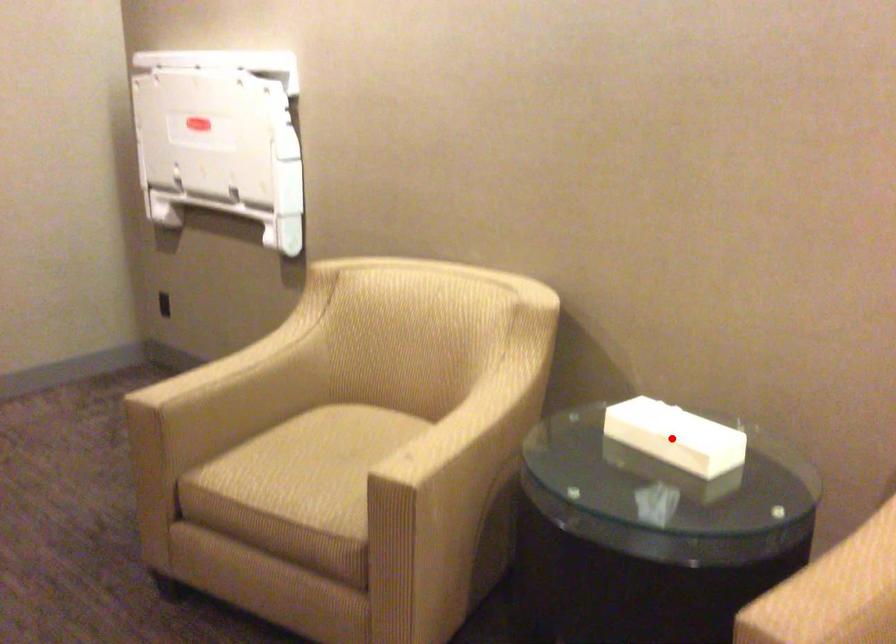
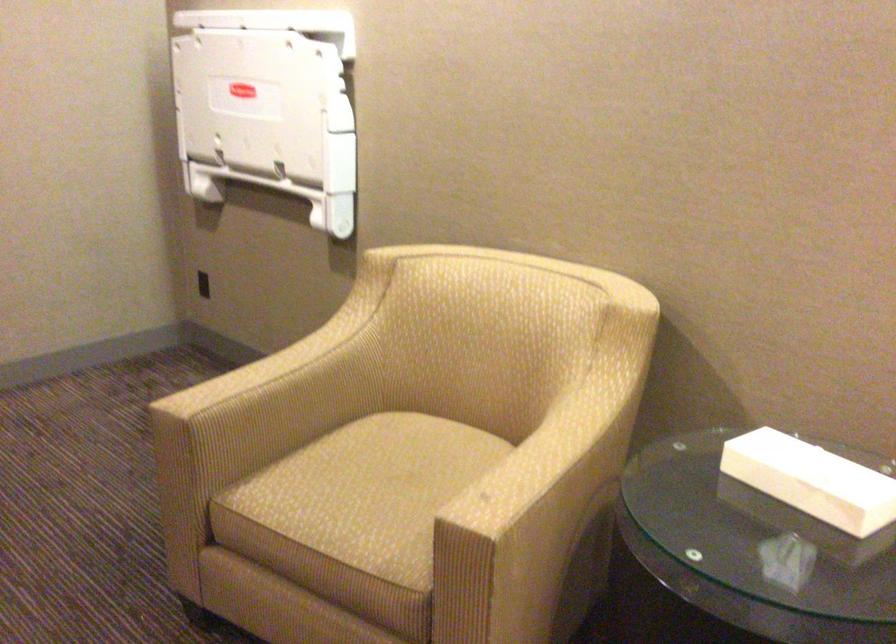
Question: A red point is marked in image1. In image2, is the corresponding 3D point closer to the camera or farther? Reply with the corresponding letter.

Choices:
 (A) The corresponding 3D point is closer.
 (B) The corresponding 3D point is farther.

Answer: (A)